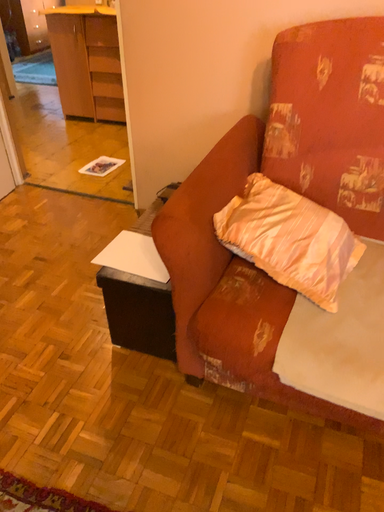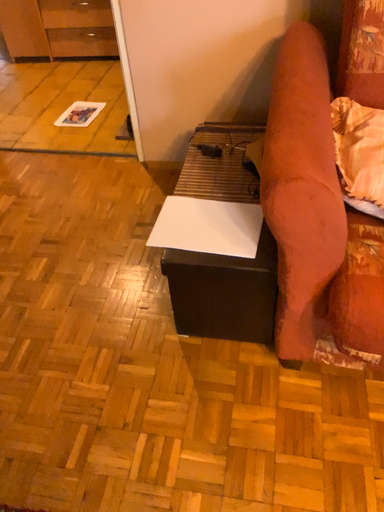
Question: Which way did the camera rotate in the video?

Choices:
 (A) rotated left
 (B) rotated right

Answer: (B)